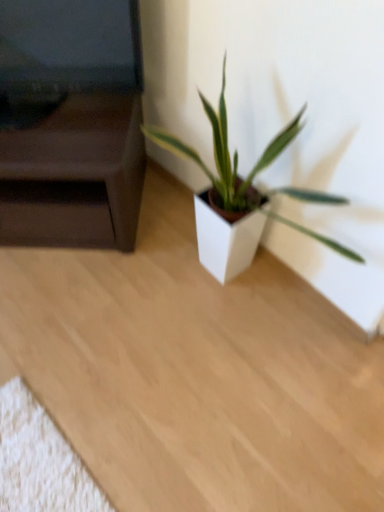
Where is `blank area beneath white matte planter at center (from a real-world perspective)`? The image size is (384, 512). blank area beneath white matte planter at center (from a real-world perspective) is located at coordinates (242, 304).